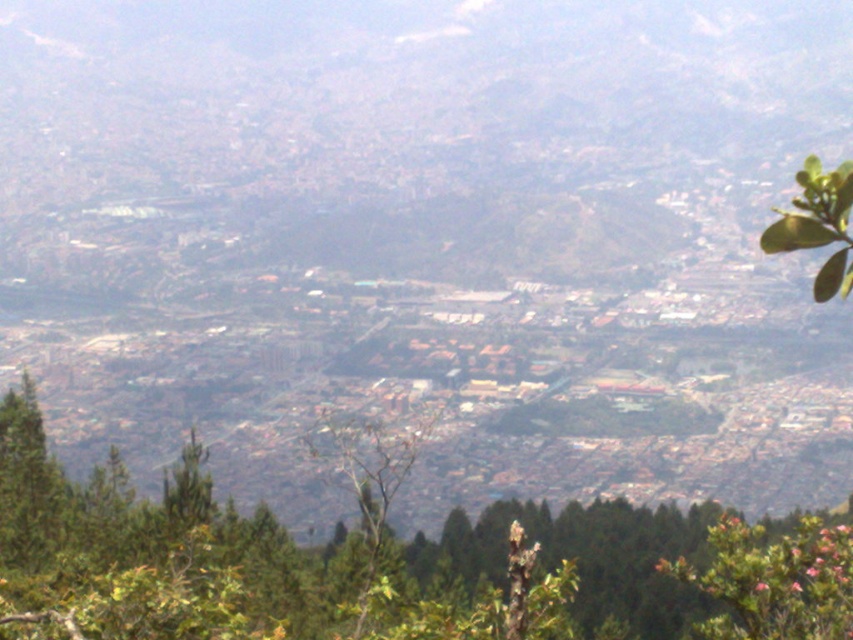
Between point (132, 518) and point (819, 177), which one is positioned in front?

Point (819, 177) is in front.

Does green leafy tree at center have a greater height compared to green leafy tree at upper right?

Indeed, green leafy tree at center has a greater height compared to green leafy tree at upper right.

Is point (260, 625) positioned after point (817, 244)?

That is True.

Locate an element on the screen. green leafy tree at center is located at coordinates (386, 563).